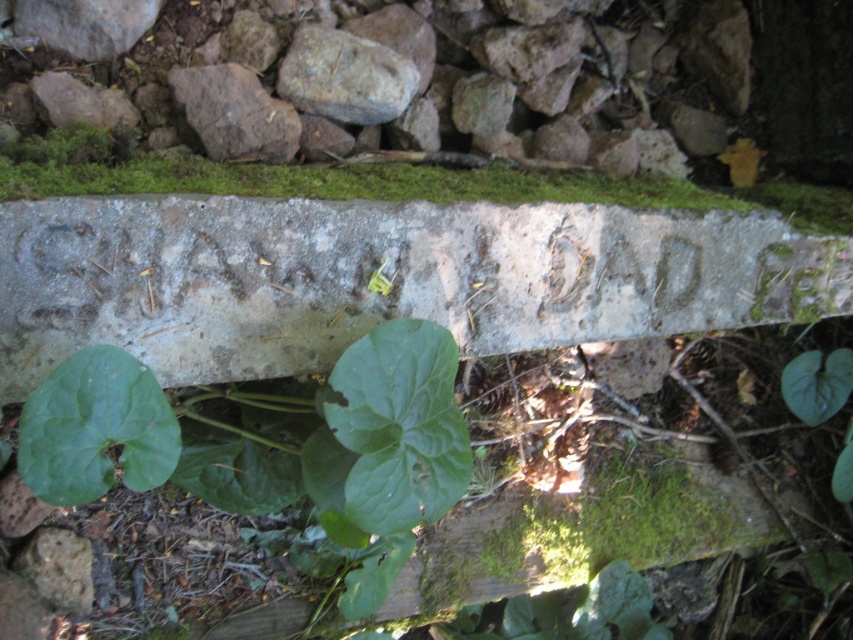
You are a botanist examining the stone structure. You notice the smooth gray stone at upper center and the smooth gray rock at center. Which one is larger in size?

The smooth gray stone at upper center is bigger than the smooth gray rock at center.

You are an archaeologist examining the stone structure. You notice the smooth gray stone at upper center and the green matte leaf at center. According to your notes, the stone has carvings that might be part of an ancient map. To determine the orientation of the map, you need to know the position of the stone relative to the leaf. Which object is positioned to the right of the other?

The smooth gray stone at upper center is to the right of the green matte leaf at center.

You are a botanist examining the stone structure. You notice the green matte leaf at center and the smooth gray rock at center. Which object is closer to the ground?

The green matte leaf at center is positioned under the smooth gray rock at center, so the green matte leaf at center is closer to the ground.